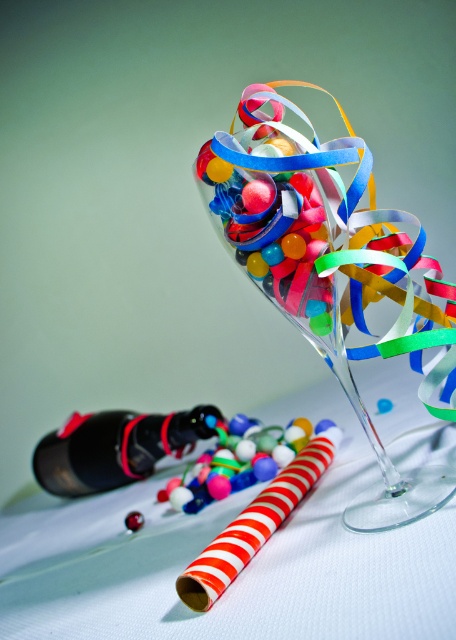
You are at position point 0.000, 0.000. The translucent glass martini glass at center is located at point 0.428, 0.732. If you want to move towards it in a straight line, which direction should you move first?

Since you are at point (0, 0) and the translucent glass martini glass at center is at point (333, 273), you should move northeast first to reach it.

You are a bartender preparing drinks and need to place both the translucent glass martini glass at center and the black matte bottle at lower left on a shelf. The shelf has a width of 15 cm. Which object should you place first to ensure both can fit?

The translucent glass martini glass at center has a lesser width compared to the black matte bottle at lower left. Therefore, you should place the black matte bottle at lower left first, as it is wider, to ensure both can fit on the 15 cm shelf.

You are a bartender preparing drinks for a party. You have a translucent glass martini glass at center and a black matte bottle at lower left. Which object is bigger?

The translucent glass martini glass at center is larger in size than the black matte bottle at lower left.